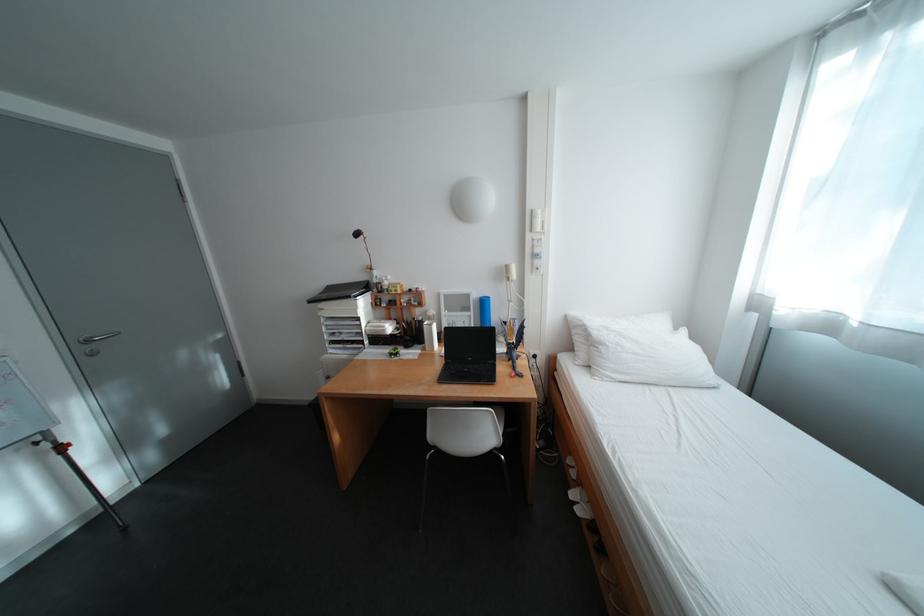
The location [430,331] corresponds to which object?

This point indicates the white tape dispenser.